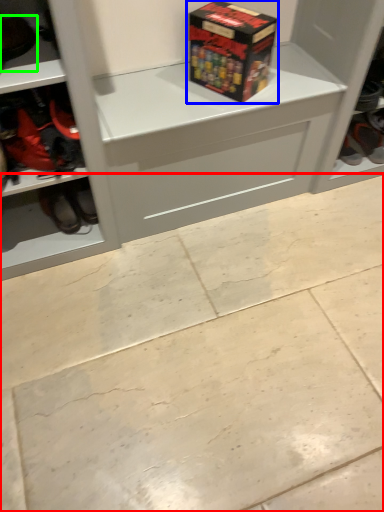
Question: Which object is the farthest from concrete (highlighted by a red box)? Choose among these: box (highlighted by a blue box) or footwear (highlighted by a green box).

Choices:
 (A) box
 (B) footwear

Answer: (B)